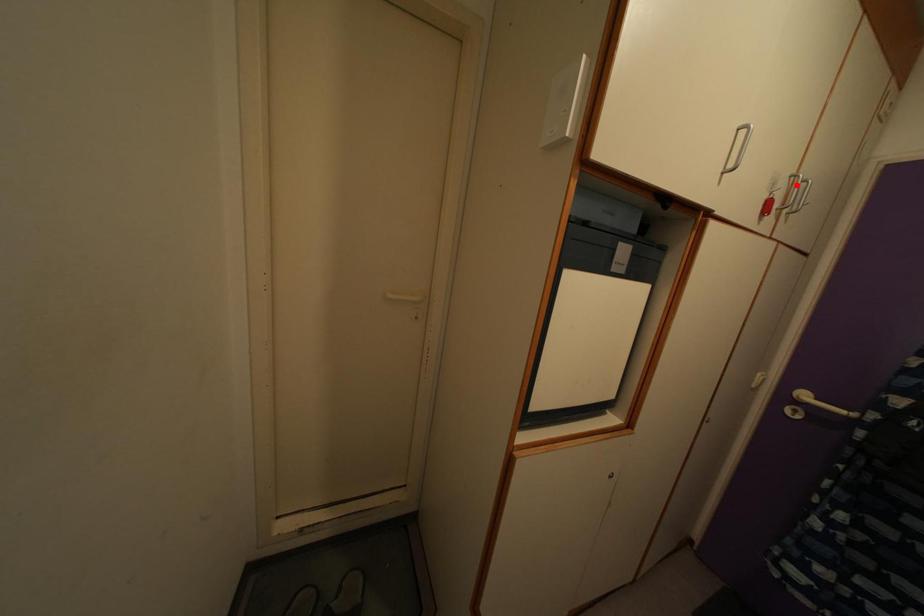
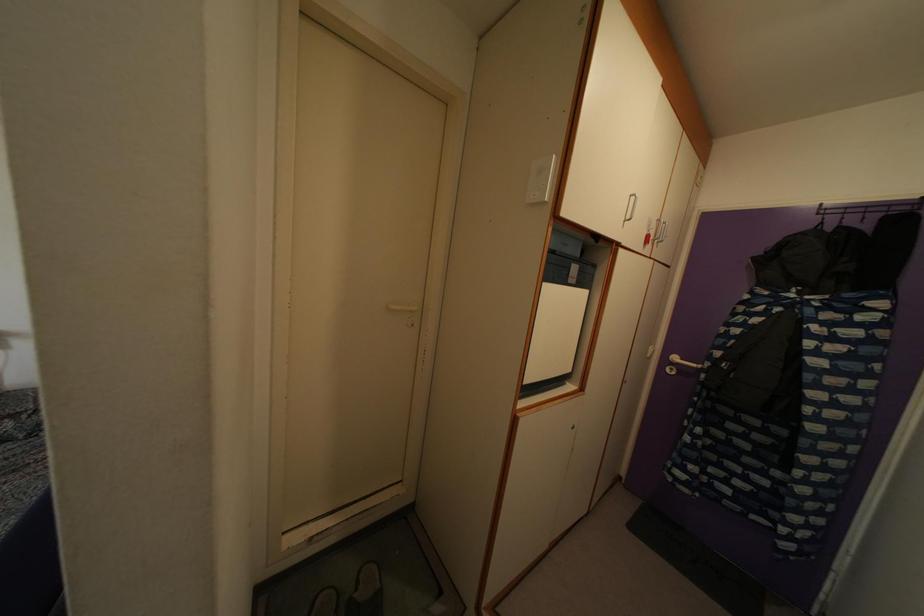
Question: A red point is marked in image1. In image2, is the corresponding 3D point closer to the camera or farther? Reply with the corresponding letter.

Choices:
 (A) The corresponding 3D point is closer.
 (B) The corresponding 3D point is farther.

Answer: (A)